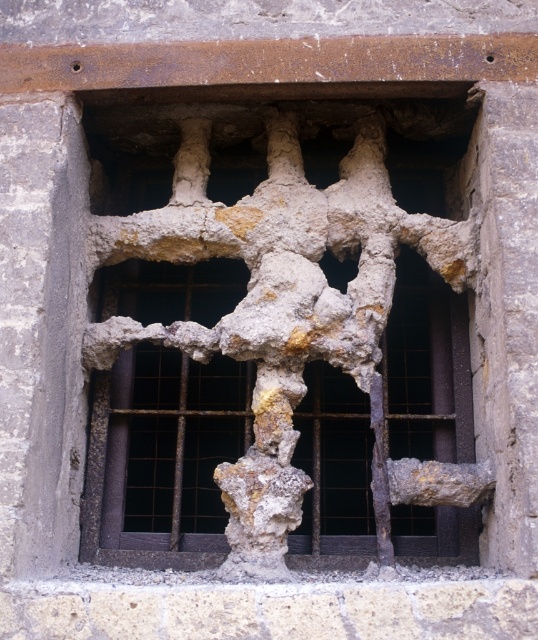
Question: Among these objects, which one is farthest from the camera?

Choices:
 (A) rusty metal hole at center
 (B) crumbly stone sculpture at center

Answer: (A)

Question: Which object appears closest to the camera in this image?

Choices:
 (A) rusty metal hole at center
 (B) crumbly stone sculpture at center

Answer: (B)

Question: Does crumbly stone sculpture at center have a smaller size compared to rusty metal hole at center?

Choices:
 (A) yes
 (B) no

Answer: (B)

Question: Is crumbly stone sculpture at center in front of rusty metal hole at center?

Choices:
 (A) no
 (B) yes

Answer: (B)

Question: Is crumbly stone sculpture at center wider than rusty metal hole at center?

Choices:
 (A) yes
 (B) no

Answer: (A)